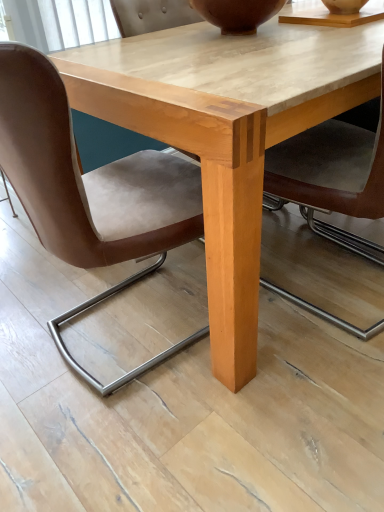
Where is `free space in front of brown matte vase at upper center`? free space in front of brown matte vase at upper center is located at coordinates (261, 47).